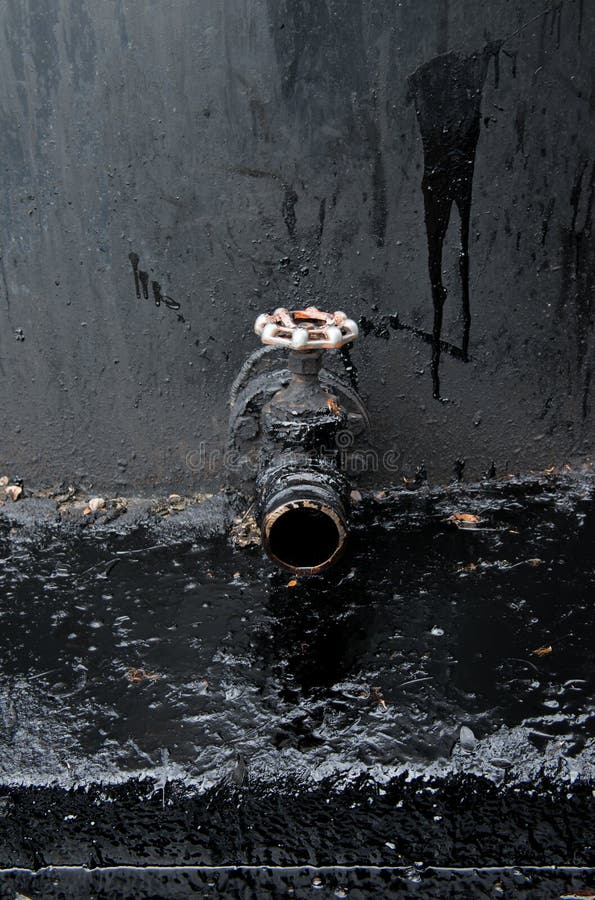
Locate an element on the screen. The image size is (595, 900). orange paint is located at coordinates (472, 517), (538, 649), (292, 581).